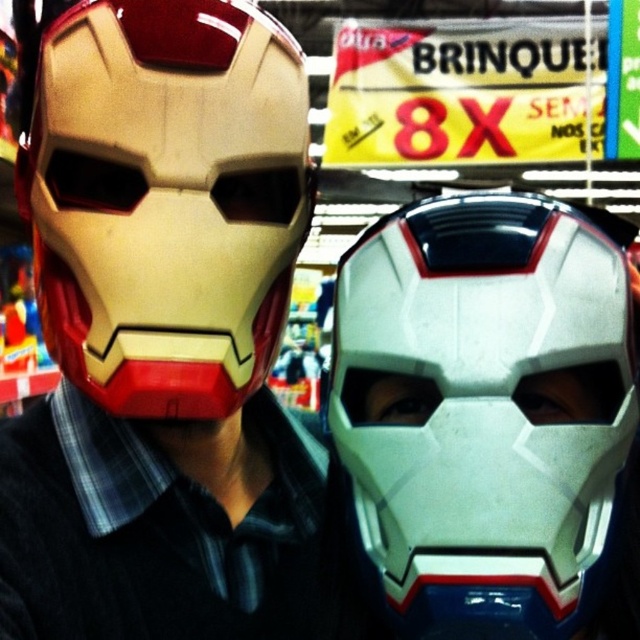
Does point (438, 528) come farther from viewer compared to point (100, 172)?

That is False.

Does white matte helmet at center lie in front of matte gold helmet at center?

Yes, it is.

You are a GUI agent. You are given a task and a screenshot of the screen. Output one action in this format:
    pyautogui.click(x=<x>, y=<y>)
    Task: Click on the white matte helmet at center
    The width and height of the screenshot is (640, 640).
    Given the screenshot: What is the action you would take?
    pyautogui.click(x=484, y=410)

Does white matte helmet at center appear over white matte mask at center?

Yes.

Who is shorter, white matte helmet at center or white matte mask at center?

Standing shorter between the two is white matte mask at center.

Between point (513, 515) and point (550, 400), which one is positioned behind?

Positioned behind is point (550, 400).

The height and width of the screenshot is (640, 640). What are the coordinates of `white matte helmet at center` in the screenshot? It's located at (484, 410).

Can you confirm if matte gold helmet at center is smaller than white matte mask at center?

No.

Where is `matte gold helmet at center`? matte gold helmet at center is located at coordinates (166, 198).

You are a GUI agent. You are given a task and a screenshot of the screen. Output one action in this format:
    pyautogui.click(x=<x>, y=<y>)
    Task: Click on the matte gold helmet at center
    The image size is (640, 640).
    Given the screenshot: What is the action you would take?
    point(166,198)